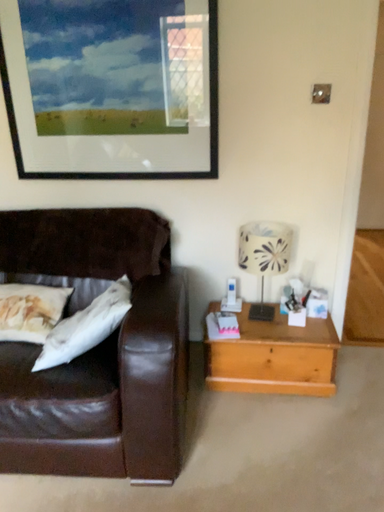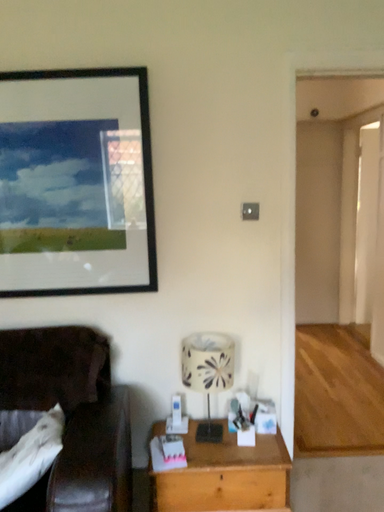
Question: How did the camera likely rotate when shooting the video?

Choices:
 (A) rotated upward
 (B) rotated downward

Answer: (A)